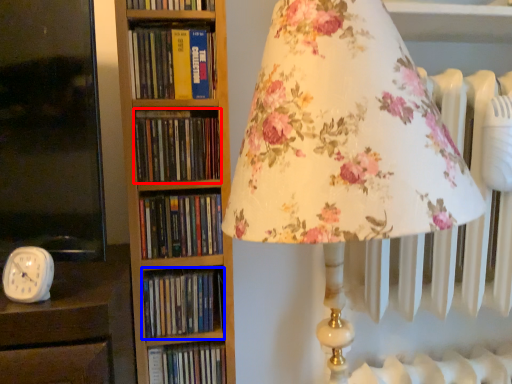
Question: Which object appears closest to the camera in this image, book (highlighted by a red box) or book (highlighted by a blue box)?

Choices:
 (A) book
 (B) book

Answer: (A)